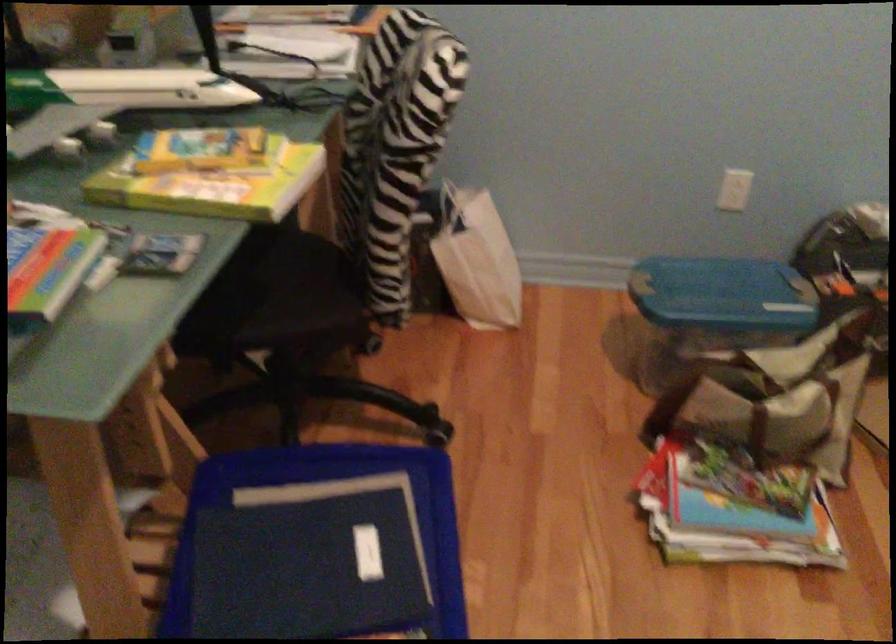
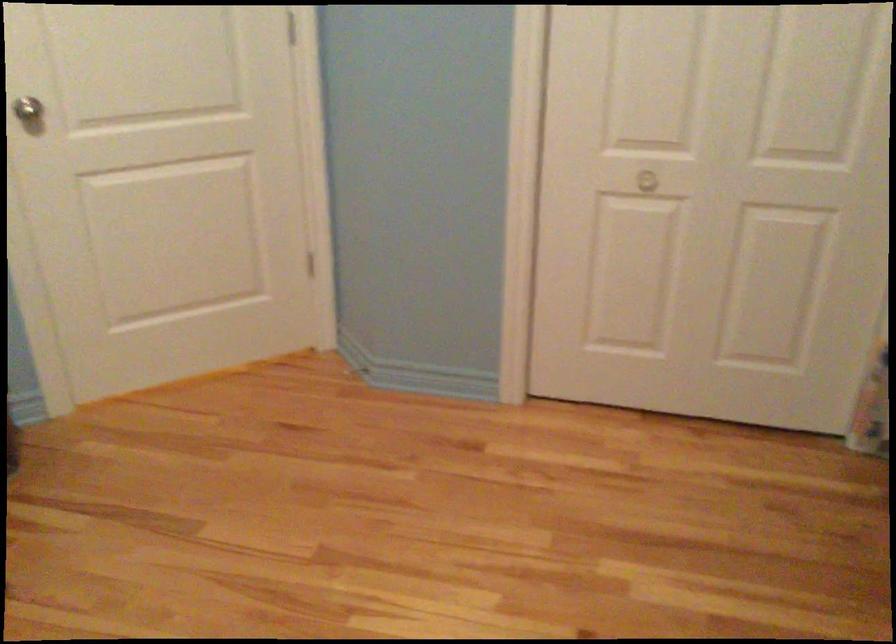
Based on the continuous images, in which direction is the camera rotating?

The camera rotated toward right-down.